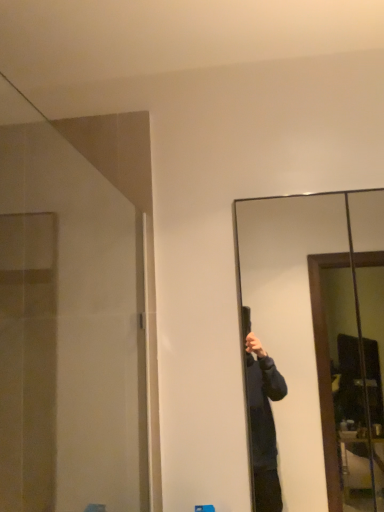
Describe the element at coordinates (69, 331) in the screenshot. I see `matte glass mirror at left` at that location.

The width and height of the screenshot is (384, 512). I want to click on matte glass mirror at left, so click(x=69, y=331).

You are a GUI agent. You are given a task and a screenshot of the screen. Output one action in this format:
    pyautogui.click(x=<x>, y=<y>)
    Task: Click on the matte glass mirror at left
    This screenshot has height=512, width=384.
    Given the screenshot: What is the action you would take?
    pyautogui.click(x=69, y=331)